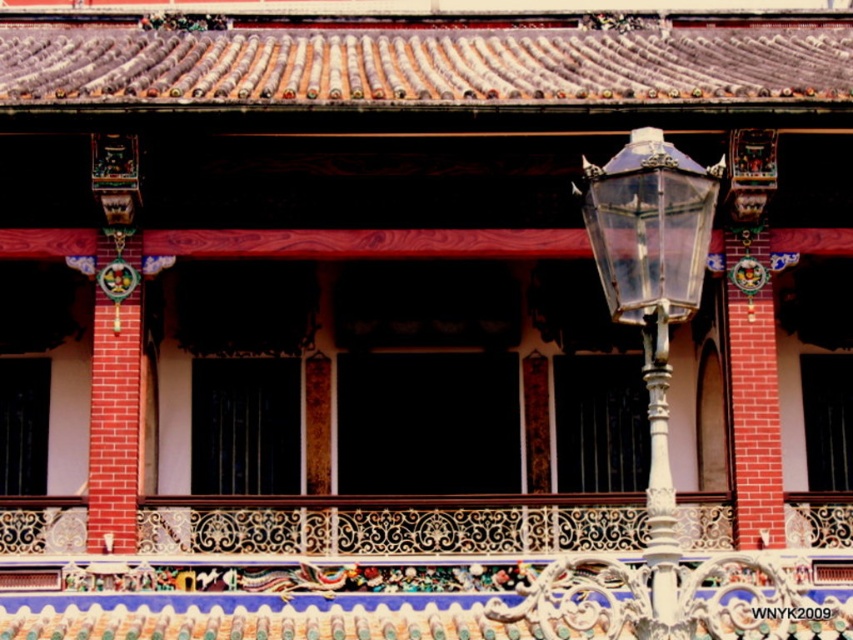
You are an architect examining the structure of this East Asian building. You notice two points marked on the facade. Which point is closer to you, point (221,598) or point (686,264)?

Point (221,598) is closer to you than point (686,264).

You are standing in front of the traditional East Asian building and want to take a photo of both the decorative wrought iron balcony at center and the clear glass lamp post at right. Which object should you focus on first to ensure both are in the frame?

You should focus on the decorative wrought iron balcony at center first since it is closer to the viewer than the clear glass lamp post at right, ensuring both are in the frame by adjusting the camera angle accordingly.